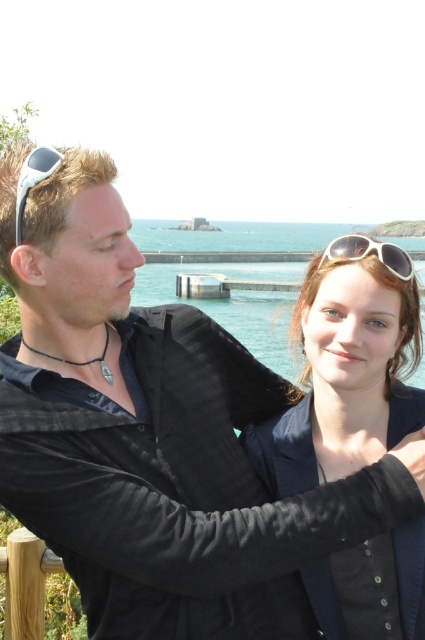
Question: Which of the following is the closest to the observer?

Choices:
 (A) matte black jacket at center
 (B) white plastic sunglasses at upper center
 (C) sunglasses at left

Answer: (C)

Question: Is white plastic sunglasses at upper center smaller than sunglasses at left?

Choices:
 (A) no
 (B) yes

Answer: (A)

Question: Is matte black jacket at center positioned in front of white plastic sunglasses at upper center?

Choices:
 (A) no
 (B) yes

Answer: (B)

Question: Which point is farther to the camera?

Choices:
 (A) matte black jacket at center
 (B) sunglasses at left
 (C) white plastic sunglasses at upper center

Answer: (C)

Question: Does matte black jacket at center appear under white plastic sunglasses at upper center?

Choices:
 (A) yes
 (B) no

Answer: (A)

Question: Among these objects, which one is farthest from the camera?

Choices:
 (A) matte black jacket at center
 (B) sunglasses at left

Answer: (A)